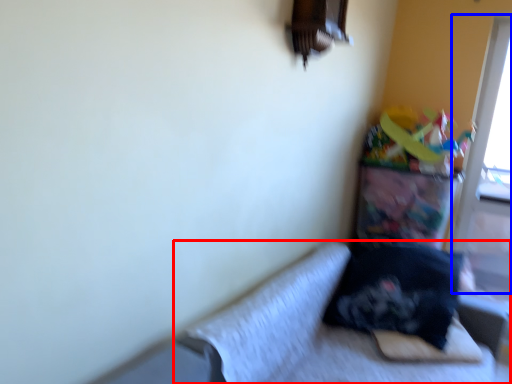
Question: Which object appears farthest to the camera in this image, studio couch (highlighted by a red box) or screen door (highlighted by a blue box)?

Choices:
 (A) studio couch
 (B) screen door

Answer: (B)